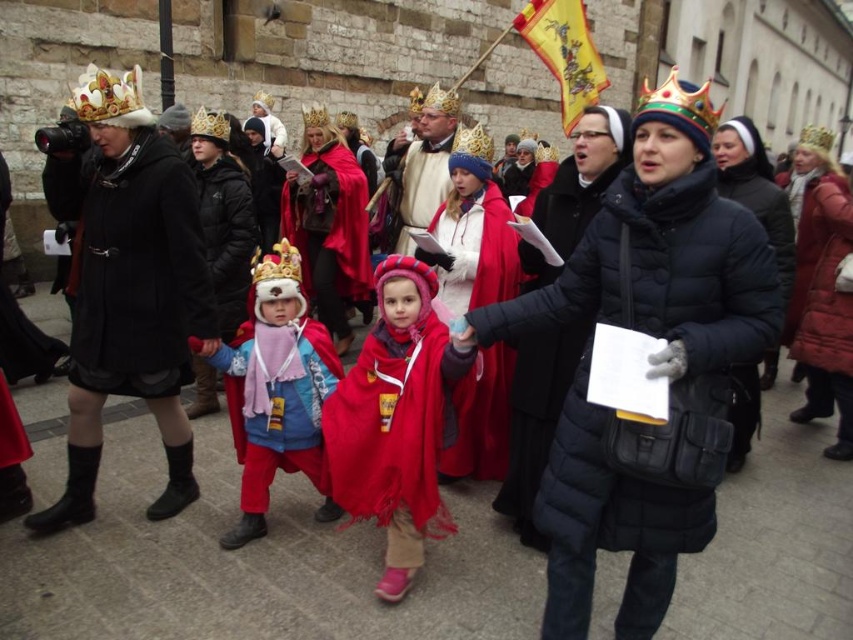
Question: Is matte black coat at left thinner than yellow fabric flag at upper center?

Choices:
 (A) no
 (B) yes

Answer: (B)

Question: Does yellow fabric flag at upper center appear on the left side of gold metallic crown at upper left?

Choices:
 (A) no
 (B) yes

Answer: (A)

Question: Is black puffy coat at center to the right of velvet red cape at center from the viewer's perspective?

Choices:
 (A) no
 (B) yes

Answer: (B)

Question: Which of these objects is positioned closest to the black puffy coat at center?

Choices:
 (A) smooth gold crown at center
 (B) black quilted jacket at center

Answer: (B)

Question: Among these points, which one is farthest from the camera?

Choices:
 (A) (x=627, y=150)
 (B) (x=119, y=86)
 (C) (x=381, y=244)

Answer: (C)

Question: Which of the following is the closest to the observer?

Choices:
 (A) (567, 406)
 (B) (312, 349)
 (C) (422, 344)
 (D) (509, 497)

Answer: (A)